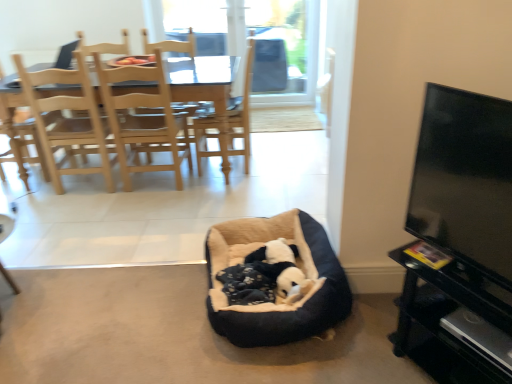
Question: From the image's perspective, does light brown wood chair at left, the 2th chair positioned from the left, appear lower than soft fleece dog bed at center?

Choices:
 (A) no
 (B) yes

Answer: (A)

Question: Is light brown wood chair at left, the first chair in the right-to-left sequence, positioned behind soft fleece dog bed at center?

Choices:
 (A) no
 (B) yes

Answer: (B)

Question: From a real-world perspective, is light brown wood chair at left, the 2th chair positioned from the left, on soft fleece dog bed at center?

Choices:
 (A) yes
 (B) no

Answer: (A)

Question: Can you confirm if light brown wood chair at left, the first chair in the right-to-left sequence, is wider than soft fleece dog bed at center?

Choices:
 (A) yes
 (B) no

Answer: (A)

Question: Does light brown wood chair at left, the 2th chair positioned from the left, lie in front of soft fleece dog bed at center?

Choices:
 (A) no
 (B) yes

Answer: (A)

Question: Considering the positions of light wood chair at upper left, the 1th chair positioned from the left, and black glossy tv stand at lower right in the image, is light wood chair at upper left, the 1th chair positioned from the left, bigger or smaller than black glossy tv stand at lower right?

Choices:
 (A) big
 (B) small

Answer: (A)

Question: Choose the correct answer: Is light wood chair at upper left, arranged as the 2th chair when viewed from the right, inside black glossy tv stand at lower right or outside it?

Choices:
 (A) outside
 (B) inside

Answer: (A)

Question: From their relative heights in the image, would you say light wood chair at upper left, arranged as the 2th chair when viewed from the right, is taller or shorter than black glossy tv stand at lower right?

Choices:
 (A) short
 (B) tall

Answer: (B)

Question: Is point (109, 170) closer or farther from the camera than point (472, 309)?

Choices:
 (A) farther
 (B) closer

Answer: (A)

Question: Is light wood dining chair at upper left wider or thinner than black plush dog bed at center?

Choices:
 (A) wide
 (B) thin

Answer: (A)

Question: Would you say light wood dining chair at upper left is to the left or to the right of black plush dog bed at center in the picture?

Choices:
 (A) left
 (B) right

Answer: (A)

Question: From the image's perspective, is light wood dining chair at upper left above or below black plush dog bed at center?

Choices:
 (A) above
 (B) below

Answer: (A)

Question: Is light wood dining chair at upper left in front of or behind black plush dog bed at center in the image?

Choices:
 (A) behind
 (B) front

Answer: (A)

Question: Would you say black plush dog bed at center is inside or outside black glossy tv stand at lower right?

Choices:
 (A) outside
 (B) inside

Answer: (A)

Question: From their relative heights in the image, would you say black plush dog bed at center is taller or shorter than black glossy tv stand at lower right?

Choices:
 (A) tall
 (B) short

Answer: (B)